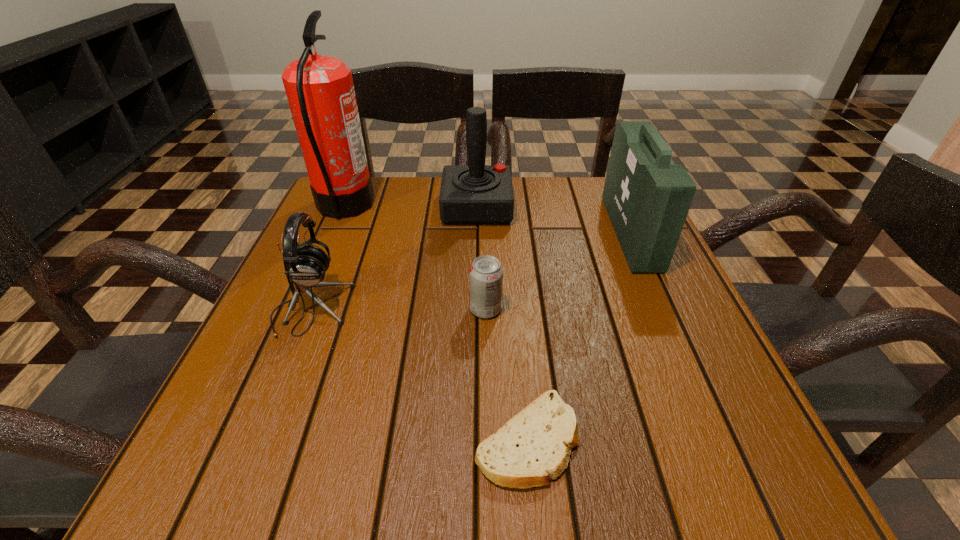
This screenshot has width=960, height=540. Find the location of `free space located on the front-facing side of the rightmost object`. free space located on the front-facing side of the rightmost object is located at coordinates (483, 233).

At what (x,y) coordinates should I click in order to perform the action: click on vacant space located on the front-facing side of the rightmost object. Please return your answer as a coordinate pair (x, y). Image resolution: width=960 pixels, height=540 pixels. Looking at the image, I should click on (470, 233).

You are a GUI agent. You are given a task and a screenshot of the screen. Output one action in this format:
    pyautogui.click(x=<x>, y=<y>)
    Task: Click on the free space located on the back of the third shortest object
    
    Given the screenshot: What is the action you would take?
    pyautogui.click(x=340, y=238)

This screenshot has width=960, height=540. I want to click on free region located 0.300m on the front of the soda can, so click(x=488, y=483).

You are a GUI agent. You are given a task and a screenshot of the screen. Output one action in this format:
    pyautogui.click(x=<x>, y=<y>)
    Task: Click on the free space located 0.100m on the left of the pita bread
    The width and height of the screenshot is (960, 540).
    Given the screenshot: What is the action you would take?
    pyautogui.click(x=406, y=440)

This screenshot has width=960, height=540. Identify the location of fire extinguisher that is positioned at the far edge. (320, 91).

What are the coordinates of `joystick that is at the far edge` in the screenshot? It's located at (475, 194).

Identify the location of the first-aid kit present at the far edge. (647, 197).

The width and height of the screenshot is (960, 540). Find the location of `object that is at the near edge`. object that is at the near edge is located at coordinates pos(534,446).

Locate an element on the screen. fire extinguisher present at the left edge is located at coordinates (320, 91).